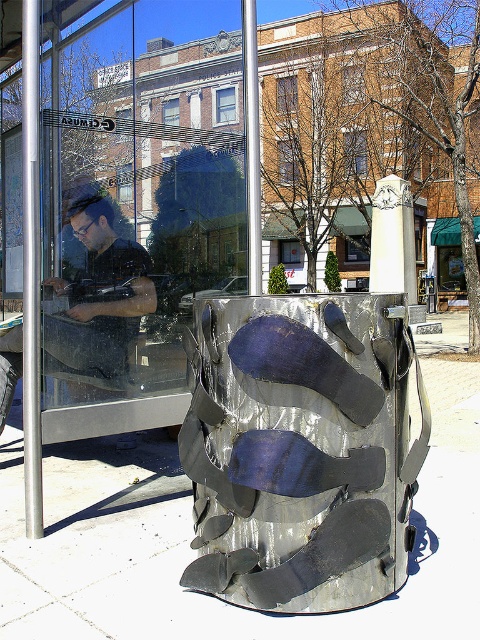
Which of these two, transparent glass at center or matte black shirt at left, stands taller?

transparent glass at center is taller.

Does transparent glass at center appear under matte black shirt at left?

No, transparent glass at center is not below matte black shirt at left.

Measure the distance between point (68, 266) and camera.

Point (68, 266) is 5.51 meters away from camera.

Locate an element on the screen. This screenshot has width=480, height=640. transparent glass at center is located at coordinates (127, 225).

Who is positioned more to the left, transparent glass at center or metallic silver sculpture at center?

transparent glass at center is more to the left.

Can you confirm if transparent glass at center is shorter than metallic silver sculpture at center?

No.

Identify the location of transparent glass at center. (127, 225).

Does metallic silver sculpture at center appear on the left side of matte black shirt at left?

In fact, metallic silver sculpture at center is to the right of matte black shirt at left.

Who is more distant from viewer, (312, 308) or (1, 369)?

Point (1, 369)

I want to click on metallic silver sculpture at center, so click(301, 449).